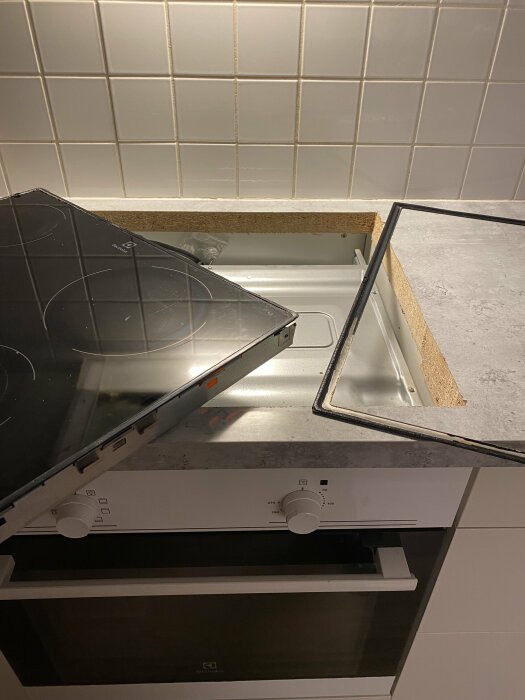
Identify the location of white knob on right. This screenshot has height=700, width=525. (302, 524).